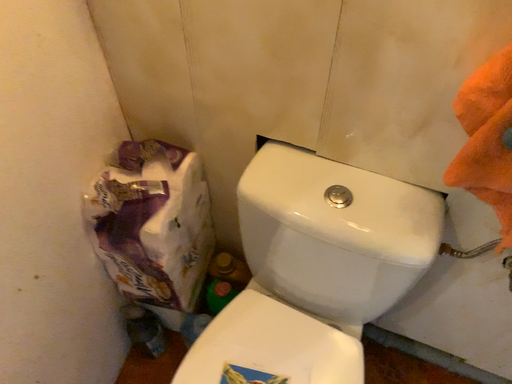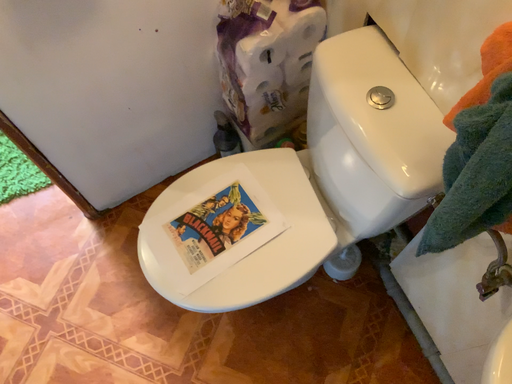
Question: How did the camera likely rotate when shooting the video?

Choices:
 (A) rotated right
 (B) rotated left

Answer: (B)